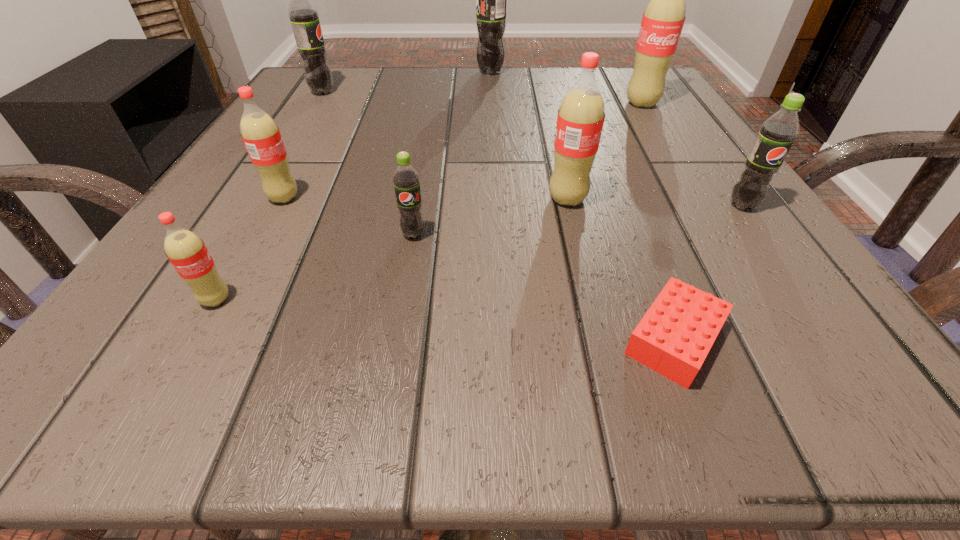
You are a GUI agent. You are given a task and a screenshot of the screen. Output one action in this format:
    pyautogui.click(x=<x>, y=<y>)
    Task: Click on the soda that stands as the closest to the third biggest red soda
    
    Given the screenshot: What is the action you would take?
    pyautogui.click(x=188, y=254)

I want to click on soda that can be found as the second closest to the rightmost green soda, so click(x=663, y=19).

Choose which green soda is the nearest neighbor to the second farthest green soda. Please provide its 2D coordinates. Your answer should be formatted as a tuple, i.e. [(x, y)], where the tuple contains the x and y coordinates of a point satisfying the conditions above.

[(491, 0)]

This screenshot has height=540, width=960. Identify the location of the fourth closest green soda to the farthest red soda. (304, 17).

Locate an element on the screen. The height and width of the screenshot is (540, 960). red soda that is the fourth closest one to the farthest green soda is located at coordinates (188, 254).

Choose which red soda is the nearest neighbor to the second biggest red soda. Please provide its 2D coordinates. Your answer should be formatted as a tuple, i.e. [(x, y)], where the tuple contains the x and y coordinates of a point satisfying the conditions above.

[(663, 19)]

The height and width of the screenshot is (540, 960). Identify the location of vacant space that satisfies the following two spatial constraints: 1. on the front label of the smallest red soda; 2. on the left side of the leftmost green soda. (196, 300).

Where is `free space in the image that satisfies the following two spatial constraints: 1. on the front label of the biggest green soda; 2. on the front label of the fourth soda from left to right`? Image resolution: width=960 pixels, height=540 pixels. free space in the image that satisfies the following two spatial constraints: 1. on the front label of the biggest green soda; 2. on the front label of the fourth soda from left to right is located at coordinates (497, 235).

The height and width of the screenshot is (540, 960). Identify the location of blank area in the image that satisfies the following two spatial constraints: 1. on the front label of the leftmost green soda; 2. on the left side of the smallest red soda. (196, 300).